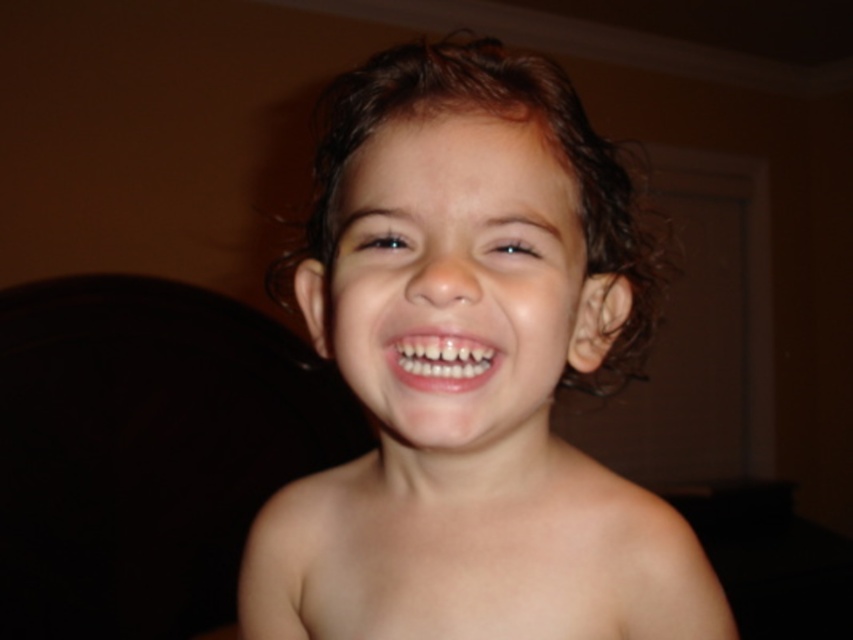
Question: Does smooth skin child at center appear on the left side of skin at center?

Choices:
 (A) no
 (B) yes

Answer: (A)

Question: Does smooth skin child at center appear on the right side of skin at center?

Choices:
 (A) no
 (B) yes

Answer: (B)

Question: Which object is farther from the camera taking this photo?

Choices:
 (A) skin at center
 (B) white glossy teeth at center

Answer: (A)

Question: Does smooth skin child at center have a smaller size compared to white glossy teeth at center?

Choices:
 (A) no
 (B) yes

Answer: (A)

Question: Based on their relative distances, which object is nearer to the skin at center?

Choices:
 (A) white glossy teeth at center
 (B) smooth skin child at center

Answer: (B)

Question: Among these objects, which one is farthest from the camera?

Choices:
 (A) smooth skin child at center
 (B) skin at center

Answer: (B)